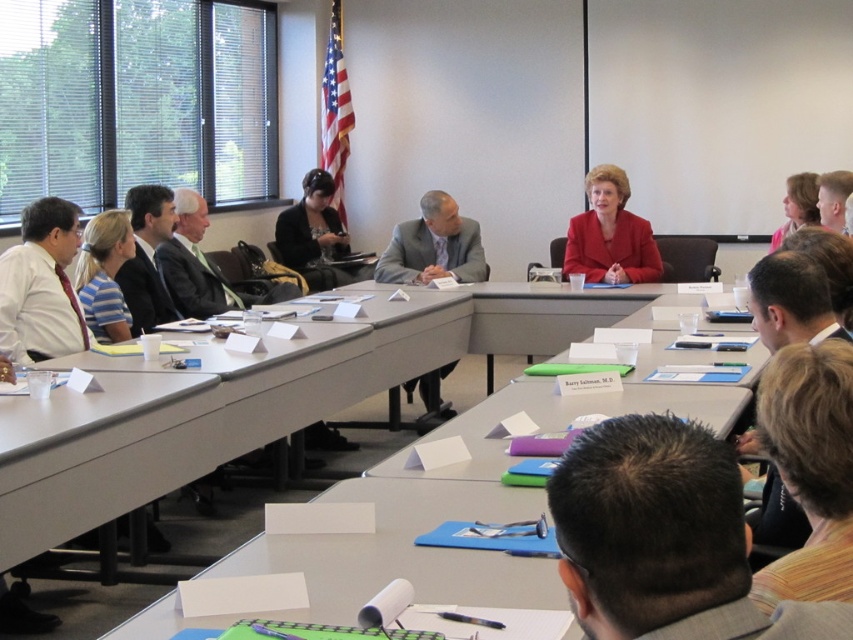
You are organizing a photo shoot in the conference room and need to position two key items on the table. The matte red blazer at center and the black fabric jacket at center must be placed such that they don not overlap. Given their sizes, which jacket should be placed closer to the edge of the table to ensure there is enough space for both?

The matte red blazer at center occupies less space than the black fabric jacket at center, so the larger black fabric jacket at center should be placed closer to the edge to allow sufficient space for both items.

In the conference room scene, there are two long rectangular tables arranged parallel to each other. The attendees are seated at both ends. The people on the left table are six in number, dressed formally with nameplates and documents. There is a U.S. flag in the background. Now, there is a point marked at coordinates (x=610, y=234). What object is located at this point?

The point at coordinates (x=610, y=234) marks the location of the matte red blazer at center.